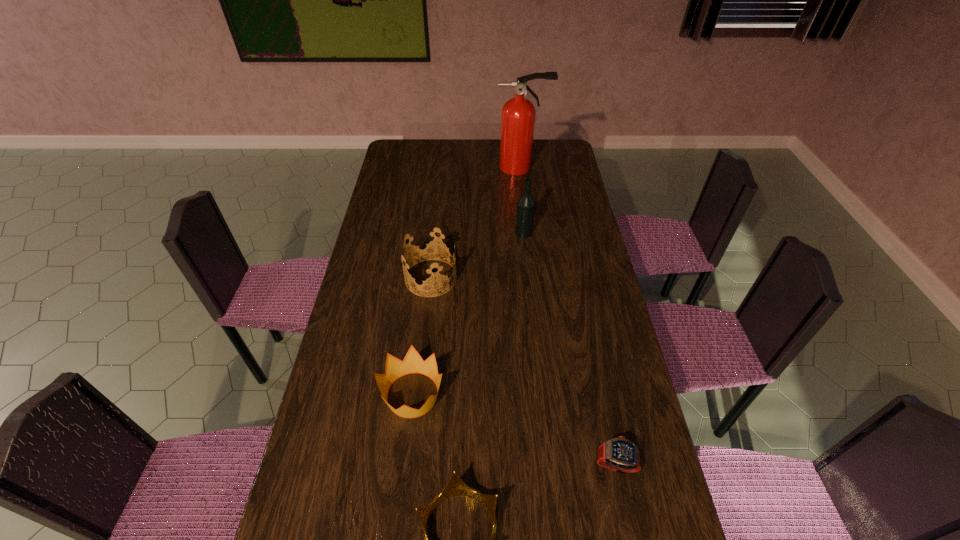
I want to click on vacant space located 0.220m on the left of the fifth shortest object, so click(x=458, y=233).

The image size is (960, 540). Find the location of `free region located 0.180m on the front of the fourth nearest object`. free region located 0.180m on the front of the fourth nearest object is located at coordinates (424, 342).

Locate an element on the screen. This screenshot has height=540, width=960. vacant region located 0.170m on the back of the fourth farthest object is located at coordinates [421, 321].

Image resolution: width=960 pixels, height=540 pixels. I want to click on free space located on the left of the watch, so click(525, 463).

I want to click on object that is positioned at the far edge, so click(518, 114).

The height and width of the screenshot is (540, 960). Identify the location of object present at the left edge. (412, 363).

Find the location of a particular element. The height and width of the screenshot is (540, 960). fire extinguisher present at the right edge is located at coordinates (518, 114).

You are a GUI agent. You are given a task and a screenshot of the screen. Output one action in this format:
    pyautogui.click(x=<x>, y=<y>)
    Task: Click on the watch located in the right edge section of the desktop
    The width and height of the screenshot is (960, 540).
    Given the screenshot: What is the action you would take?
    pyautogui.click(x=619, y=454)

This screenshot has width=960, height=540. Identify the location of object present at the far right corner. tap(518, 114).

Locate an element on the screen. The image size is (960, 540). free space at the far edge of the desktop is located at coordinates (480, 143).